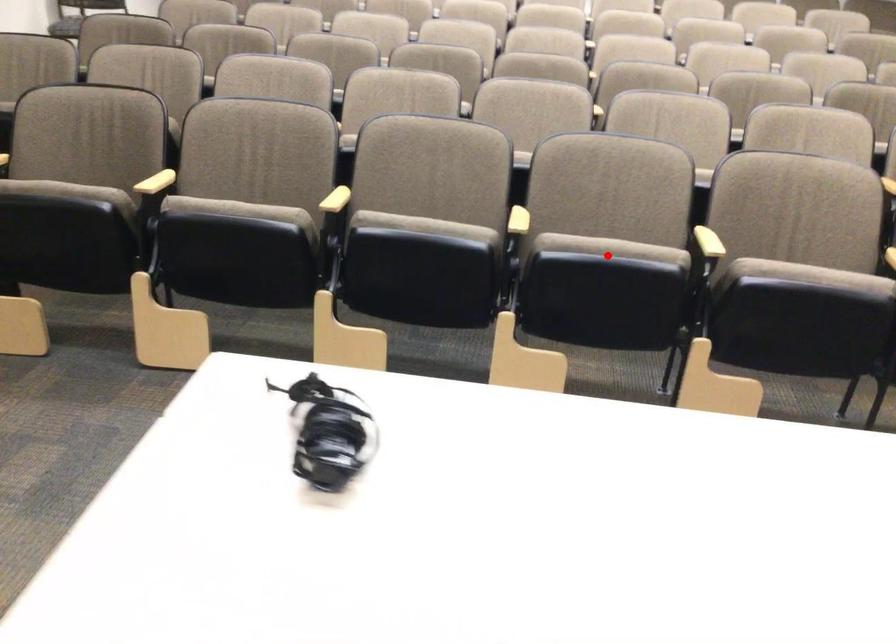
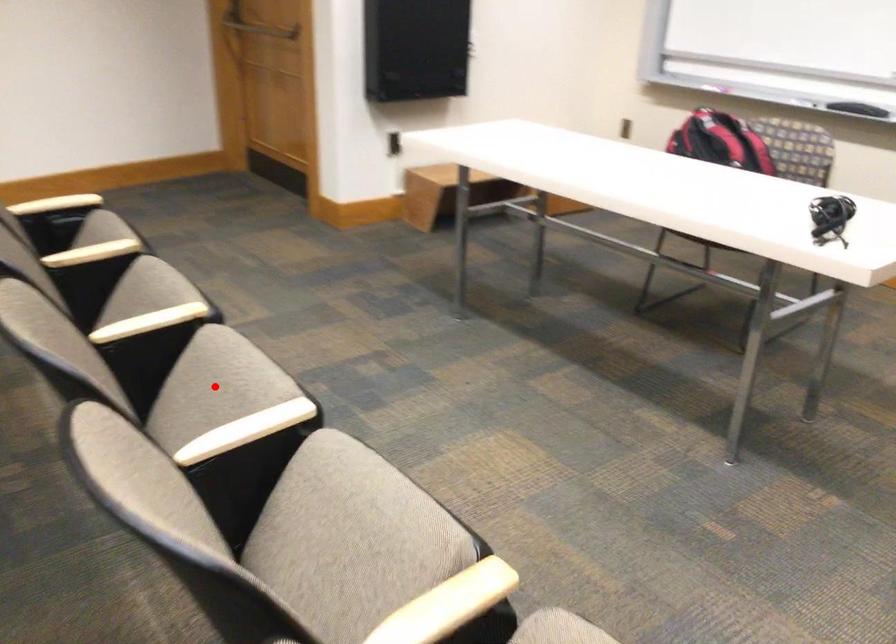
I am providing you with two images of the same scene from different viewpoints. A red point is marked on the first image and another point is marked on the second image. Are the points marked in image1 and image2 representing the same 3D position?

Yes